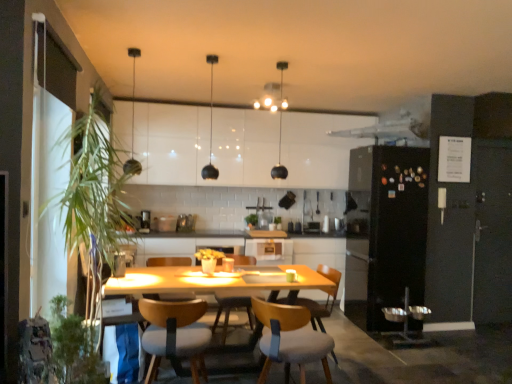
Question: Is green leafy plant at left, positioned as the 2th plant in back-to-front order, bigger than white glossy cabinet at center, which ranks as the second cabinetry in top-to-bottom order?

Choices:
 (A) yes
 (B) no

Answer: (A)

Question: Is green leafy plant at left, which is the third plant from right to left, looking in the opposite direction of white glossy cabinet at center, the first cabinetry in the bottom-to-top sequence?

Choices:
 (A) yes
 (B) no

Answer: (B)

Question: Considering the relative sizes of green leafy plant at left, positioned as the 2th plant in back-to-front order, and white glossy cabinet at center, the first cabinetry in the bottom-to-top sequence, in the image provided, is green leafy plant at left, positioned as the 2th plant in back-to-front order, wider than white glossy cabinet at center, the first cabinetry in the bottom-to-top sequence,?

Choices:
 (A) yes
 (B) no

Answer: (A)

Question: Is green leafy plant at left, which is the third plant from right to left, facing towards white glossy cabinet at center, which ranks as the second cabinetry in top-to-bottom order?

Choices:
 (A) no
 (B) yes

Answer: (A)

Question: Can you confirm if green leafy plant at left, which is the third plant from right to left, is smaller than white glossy cabinet at center, which is counted as the 2th cabinetry, starting from the front?

Choices:
 (A) no
 (B) yes

Answer: (A)

Question: Is green leafy plant at left, positioned as the 2th plant in back-to-front order, wider or thinner than black matte pendant light at center, arranged as the second light fixture when viewed from the right?

Choices:
 (A) thin
 (B) wide

Answer: (B)

Question: In terms of size, does green leafy plant at left, positioned as the 2th plant in front-to-back order, appear bigger or smaller than black matte pendant light at center, acting as the 2th light fixture starting from the left?

Choices:
 (A) big
 (B) small

Answer: (A)

Question: From the image's perspective, is green leafy plant at left, positioned as the 2th plant in front-to-back order, above or below black matte pendant light at center, acting as the 2th light fixture starting from the left?

Choices:
 (A) above
 (B) below

Answer: (B)

Question: Is green leafy plant at left, positioned as the 2th plant in back-to-front order, in front of or behind black matte pendant light at center, arranged as the second light fixture when viewed from the right, in the image?

Choices:
 (A) front
 (B) behind

Answer: (A)

Question: From a real-world perspective, is matte black pendant light at center, which is the 3th light fixture in left-to-right order, above or below wooden chair with cushion at center, the second chair from the front?

Choices:
 (A) below
 (B) above

Answer: (B)

Question: Considering the positions of point (278, 167) and point (153, 339), is point (278, 167) closer or farther from the camera than point (153, 339)?

Choices:
 (A) farther
 (B) closer

Answer: (A)

Question: Is matte black pendant light at center, placed as the first light fixture when sorted from right to left, taller or shorter than wooden chair with cushion at center, acting as the 3th chair starting from the back?

Choices:
 (A) short
 (B) tall

Answer: (B)

Question: Considering the positions of matte black pendant light at center, placed as the first light fixture when sorted from right to left, and wooden chair with cushion at center, acting as the 3th chair starting from the back, in the image, is matte black pendant light at center, placed as the first light fixture when sorted from right to left, bigger or smaller than wooden chair with cushion at center, acting as the 3th chair starting from the back,?

Choices:
 (A) big
 (B) small

Answer: (B)

Question: Considering the positions of wooden chair with cushion at center, the second chair from the front, and white glossy cabinet at center, which is counted as the 2th cabinetry, starting from the left, in the image, is wooden chair with cushion at center, the second chair from the front, taller or shorter than white glossy cabinet at center, which is counted as the 2th cabinetry, starting from the left,?

Choices:
 (A) short
 (B) tall

Answer: (B)

Question: Is wooden chair with cushion at center, the second chair from the front, in front of or behind white glossy cabinet at center, which ranks as the second cabinetry in top-to-bottom order, in the image?

Choices:
 (A) behind
 (B) front

Answer: (B)